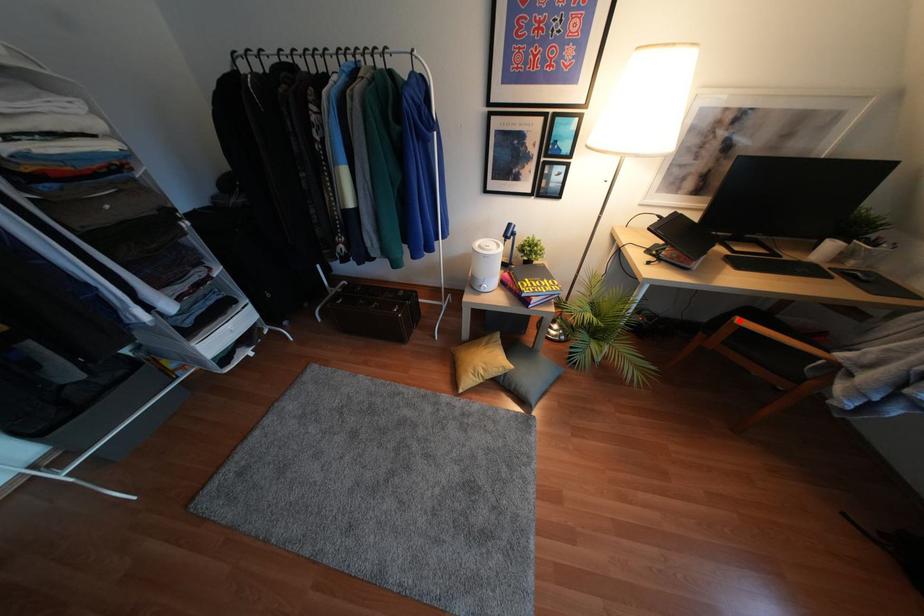
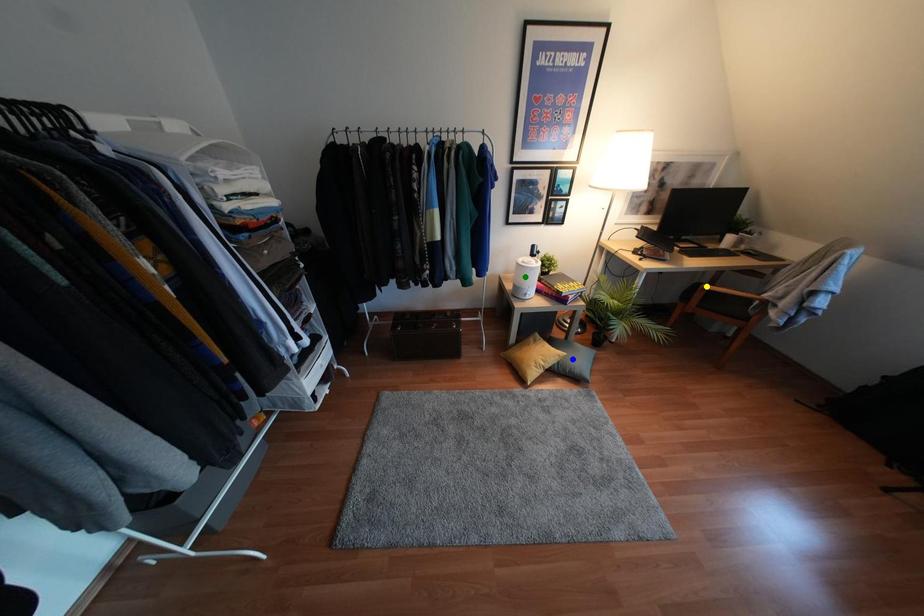
Question: I am providing you with two images of the same scene from different viewpoints. A red point is marked on the first image. You are given multiple points on the second image. Can you choose the point in image 2 that corresponds to the point in image 1?

Choices:
 (A) blue point
 (B) green point
 (C) yellow point

Answer: (C)